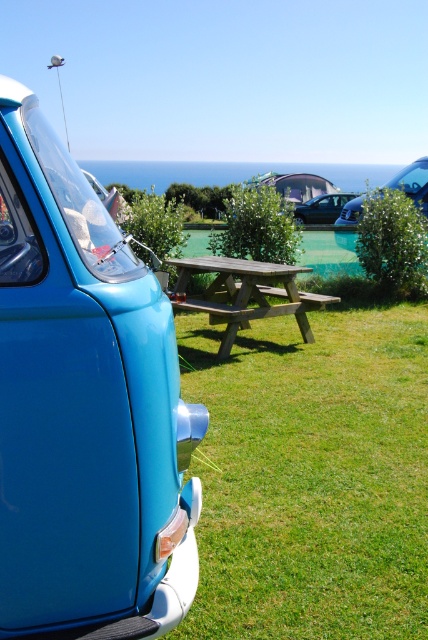
Is matte blue minivan at left to the left of wooden picnic table at center from the viewer's perspective?

Correct, you'll find matte blue minivan at left to the left of wooden picnic table at center.

Does point (166, 449) lie behind point (216, 317)?

No, it is not.

You are a GUI agent. You are given a task and a screenshot of the screen. Output one action in this format:
    pyautogui.click(x=<x>, y=<y>)
    Task: Click on the matte blue minivan at left
    
    Given the screenshot: What is the action you would take?
    pyautogui.click(x=85, y=408)

Between point (279, 266) and point (336, 204), which one is positioned in front?

Point (279, 266)

Who is more distant from viewer, [240,310] or [311,209]?

Point [311,209]

I want to click on wooden picnic table at center, so tap(244, 294).

Find the location of a particular element. The width and height of the screenshot is (428, 640). wooden picnic table at center is located at coordinates (244, 294).

Does point (415, 180) come farther from viewer compared to point (314, 209)?

No, it is not.

What do you see at coordinates (413, 182) in the screenshot? I see `metallic blue car at center` at bounding box center [413, 182].

You are a GUI agent. You are given a task and a screenshot of the screen. Output one action in this format:
    pyautogui.click(x=<x>, y=<y>)
    Task: Click on the metallic blue car at center
    
    Given the screenshot: What is the action you would take?
    pyautogui.click(x=413, y=182)